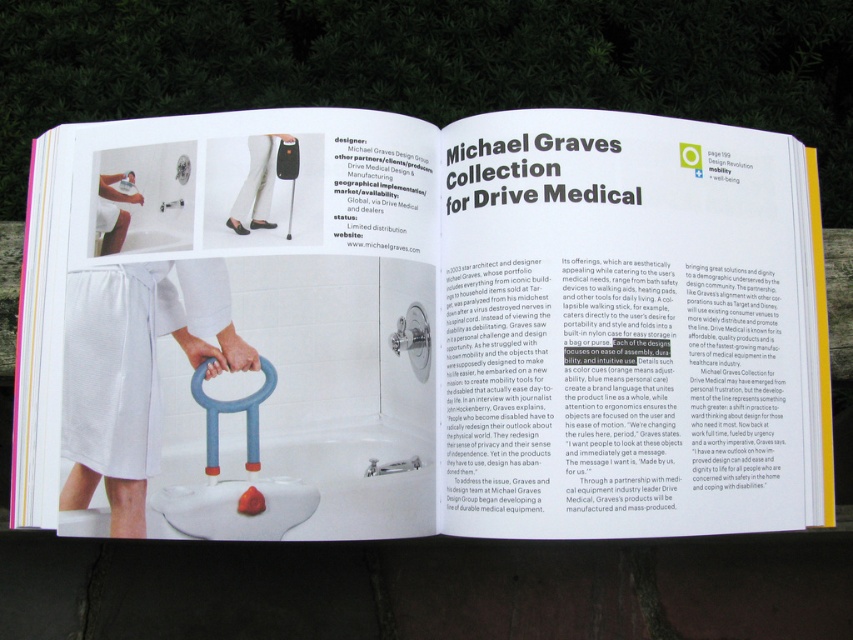
Question: Is white textured towel at lower left positioned behind blue foam stool at lower center?

Choices:
 (A) no
 (B) yes

Answer: (B)

Question: Which object is positioned farthest from the white plastic grab bar at lower center?

Choices:
 (A) white textured towel at lower left
 (B) white matte towel at lower left
 (C) blue foam stool at lower center

Answer: (B)

Question: Which point is farther to the camera?

Choices:
 (A) white matte leg at upper center
 (B) white plastic grab bar at lower center
 (C) white matte towel at lower left

Answer: (C)

Question: Which point appears closest to the camera in this image?

Choices:
 (A) (79, 317)
 (B) (136, 202)
 (C) (270, 161)

Answer: (C)

Question: From the image, what is the correct spatial relationship of white plastic grab bar at lower center in relation to white textured towel at lower left?

Choices:
 (A) left
 (B) right

Answer: (B)

Question: Does white textured towel at lower left appear under white matte leg at upper center?

Choices:
 (A) yes
 (B) no

Answer: (A)